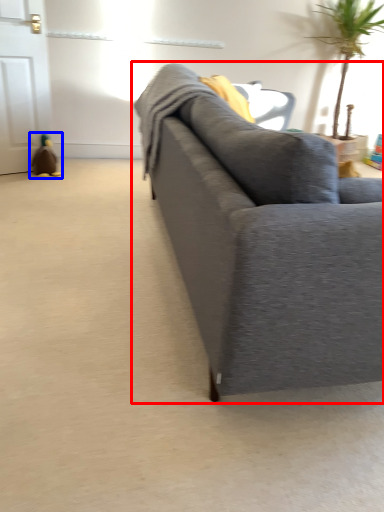
Question: Which object is closer to the camera taking this photo, studio couch (highlighted by a red box) or toy (highlighted by a blue box)?

Choices:
 (A) studio couch
 (B) toy

Answer: (A)